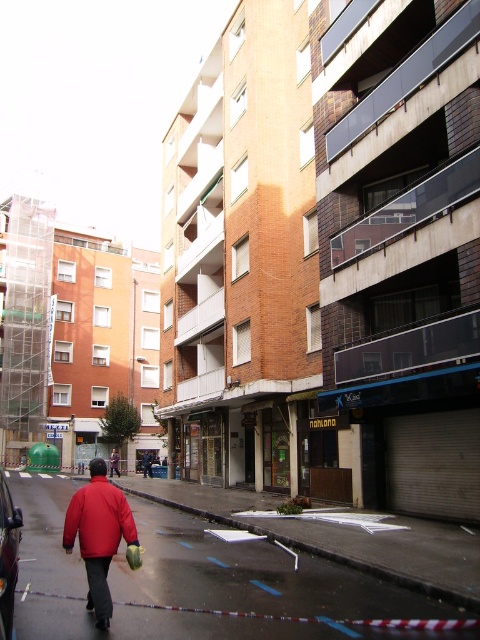
The width and height of the screenshot is (480, 640). What do you see at coordinates (253, 589) in the screenshot?
I see `concrete pavement at center` at bounding box center [253, 589].

Does concrete pavement at center appear over dark blue jeans at center?

Correct, concrete pavement at center is located above dark blue jeans at center.

What do you see at coordinates (253, 589) in the screenshot?
I see `concrete pavement at center` at bounding box center [253, 589].

Locate an element on the screen. The width and height of the screenshot is (480, 640). concrete pavement at center is located at coordinates (253, 589).

Does point (35, 556) lie behind point (86, 534)?

Yes, point (35, 556) is farther from viewer.

Can you confirm if concrete pavement at center is shorter than red matte jacket at lower left?

Yes.

Who is more distant from viewer, (149, 577) or (82, 508)?

The point (149, 577) is more distant.

Locate an element on the screen. concrete pavement at center is located at coordinates (253, 589).

Between point (45, 572) and point (119, 500), which one is positioned in front?

Point (119, 500) is in front.

Between concrete pavement at center and matte red jacket at center, which one has less height?

With less height is matte red jacket at center.

Is point (128, 598) more distant than point (88, 512)?

That is True.

The width and height of the screenshot is (480, 640). Identify the location of concrete pavement at center. (253, 589).